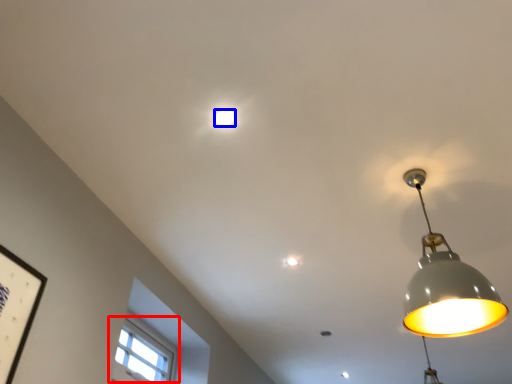
Question: Which object appears closest to the camera in this image, window (highlighted by a red box) or lamp (highlighted by a blue box)?

Choices:
 (A) window
 (B) lamp

Answer: (B)